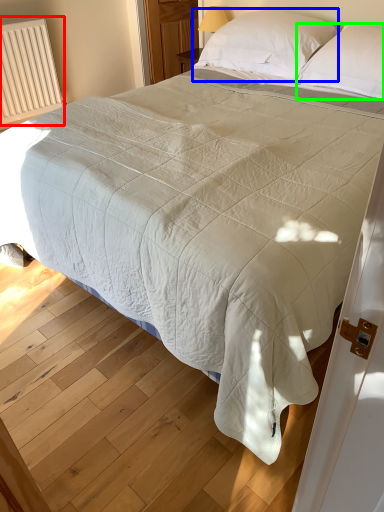
Question: Which object is positioned farthest from radiator (highlighted by a red box)? Select from pillow (highlighted by a blue box) and pillow (highlighted by a green box).

Choices:
 (A) pillow
 (B) pillow

Answer: (B)